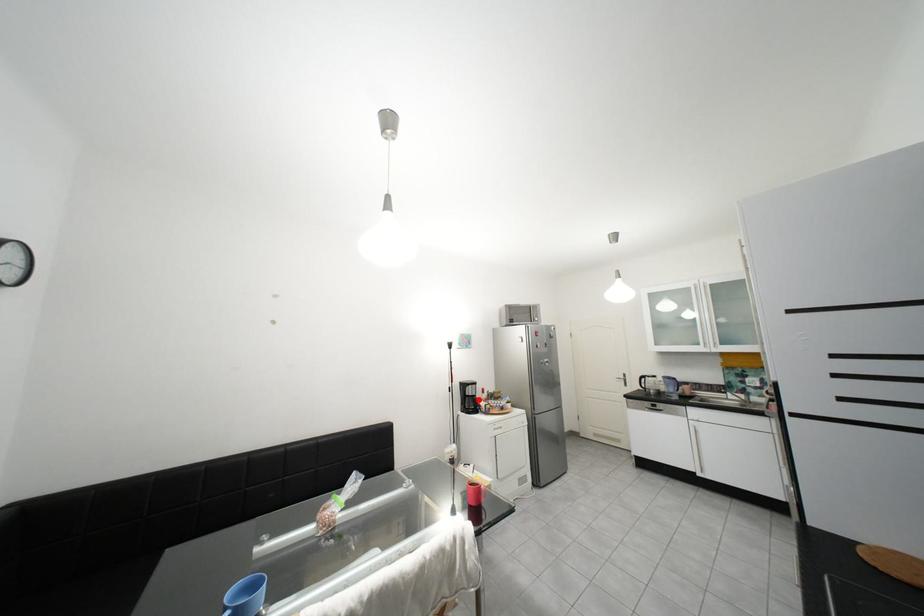
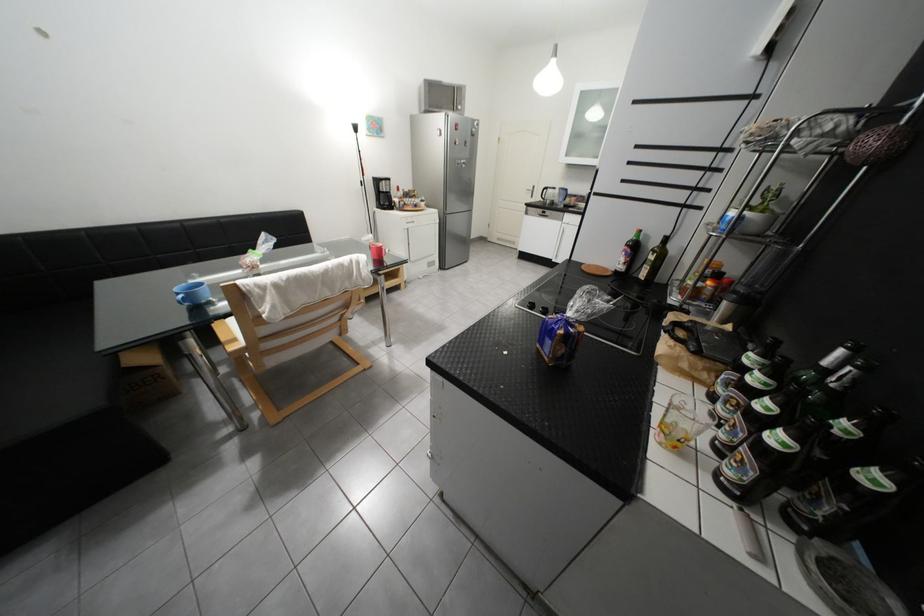
The point at the highlighted location is marked in the first image. Where is the corresponding point in the second image?

(393, 196)